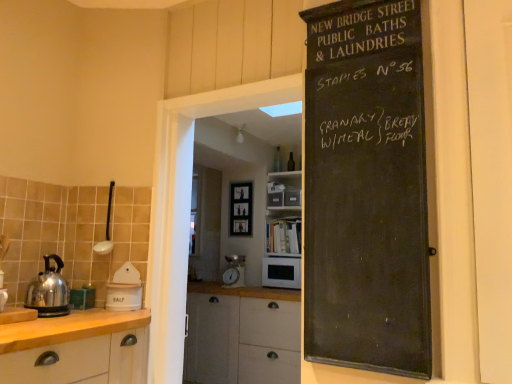
Question: Would you say white matte cabinet at left is outside metallic silver coffee machine at center?

Choices:
 (A) yes
 (B) no

Answer: (A)

Question: Is white matte cabinet at left turned away from metallic silver coffee machine at center?

Choices:
 (A) yes
 (B) no

Answer: (B)

Question: Does white matte cabinet at left have a smaller size compared to metallic silver coffee machine at center?

Choices:
 (A) yes
 (B) no

Answer: (B)

Question: Is white matte cabinet at left directly adjacent to metallic silver coffee machine at center?

Choices:
 (A) no
 (B) yes

Answer: (A)

Question: Does white matte cabinet at left appear on the right side of metallic silver coffee machine at center?

Choices:
 (A) yes
 (B) no

Answer: (B)

Question: Is polished stainless steel kettle at left in front of or behind white glossy spoon at left, which ranks as the first appliance in top-to-bottom order, in the image?

Choices:
 (A) front
 (B) behind

Answer: (A)

Question: Is polished stainless steel kettle at left inside the boundaries of white glossy spoon at left, which ranks as the 2th appliance in bottom-to-top order, or outside?

Choices:
 (A) inside
 (B) outside

Answer: (B)

Question: Is point (62, 311) positioned closer to the camera than point (97, 253)?

Choices:
 (A) closer
 (B) farther

Answer: (A)

Question: In terms of width, does polished stainless steel kettle at left look wider or thinner when compared to white glossy spoon at left, which ranks as the first appliance in top-to-bottom order?

Choices:
 (A) thin
 (B) wide

Answer: (B)

Question: Is white matte cabinet at left to the left or to the right of polished stainless steel kettle at left in the image?

Choices:
 (A) right
 (B) left

Answer: (A)

Question: Is point (135, 334) closer or farther from the camera than point (59, 304)?

Choices:
 (A) closer
 (B) farther

Answer: (A)

Question: From the image's perspective, is white matte cabinet at left located above or below polished stainless steel kettle at left?

Choices:
 (A) below
 (B) above

Answer: (A)

Question: Based on their sizes in the image, would you say white matte cabinet at left is bigger or smaller than polished stainless steel kettle at left?

Choices:
 (A) big
 (B) small

Answer: (A)

Question: Would you say white matte door at right is inside or outside white ceramic salt container at left, the 1th appliance from the bottom?

Choices:
 (A) outside
 (B) inside

Answer: (A)

Question: In terms of height, does white matte door at right look taller or shorter compared to white ceramic salt container at left, marked as the second appliance in a top-to-bottom arrangement?

Choices:
 (A) short
 (B) tall

Answer: (B)